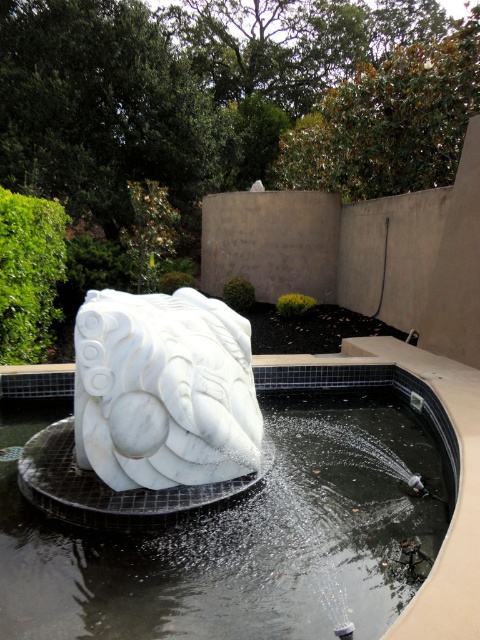
In the scene shown: Between white marble fountain at center and white marble sculpture at center, which one has more height?

Standing taller between the two is white marble sculpture at center.

Who is positioned more to the right, white marble fountain at center or white marble sculpture at center?

Positioned to the right is white marble fountain at center.

Measure the distance between point (29, 600) and camera.

The distance of point (29, 600) from camera is 6.82 feet.

Image resolution: width=480 pixels, height=640 pixels. I want to click on white marble fountain at center, so click(x=256, y=528).